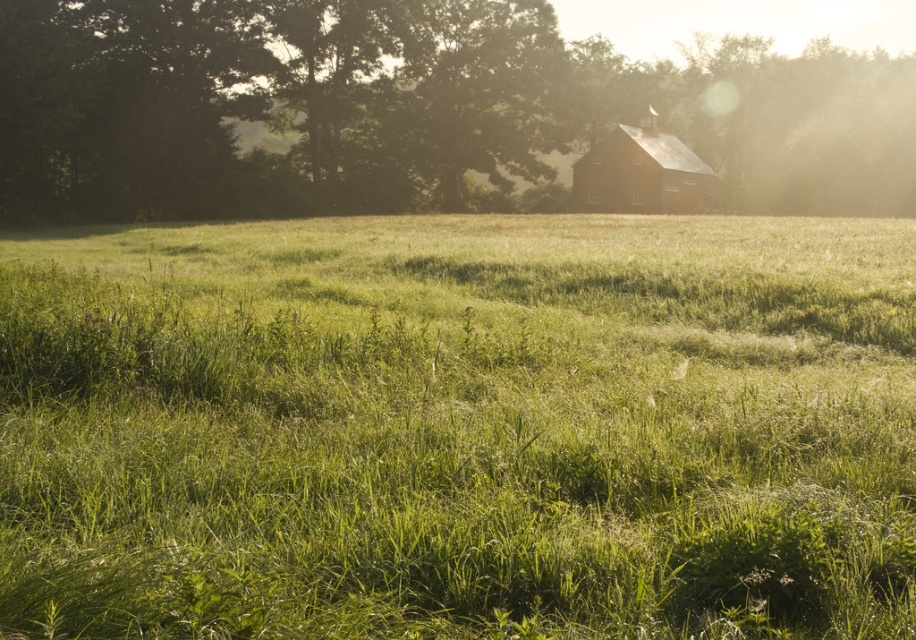
In the scene shown: Does green grassy pasture at center appear on the right side of green leafy tree at upper center?

Incorrect, green grassy pasture at center is not on the right side of green leafy tree at upper center.

Does green grassy pasture at center have a lesser width compared to green leafy tree at upper center?

Indeed, green grassy pasture at center has a lesser width compared to green leafy tree at upper center.

Does point (47, 326) come closer to viewer compared to point (264, 186)?

Yes, it is.

Locate an element on the screen. This screenshot has height=640, width=916. green grassy pasture at center is located at coordinates [x=459, y=428].

How distant is green leafy tree at upper center from matte red barn at center?

9.83 meters

Describe the element at coordinates (409, 108) in the screenshot. The width and height of the screenshot is (916, 640). I see `green leafy tree at upper center` at that location.

Measure the distance between green leafy tree at upper center and camera.

A distance of 39.45 meters exists between green leafy tree at upper center and camera.

Locate an element on the screen. green leafy tree at upper center is located at coordinates (409, 108).

Which of these two, green grassy pasture at center or matte red barn at center, stands shorter?

Standing shorter between the two is green grassy pasture at center.

Does green grassy pasture at center appear on the left side of matte red barn at center?

Indeed, green grassy pasture at center is positioned on the left side of matte red barn at center.

The width and height of the screenshot is (916, 640). I want to click on green grassy pasture at center, so click(459, 428).